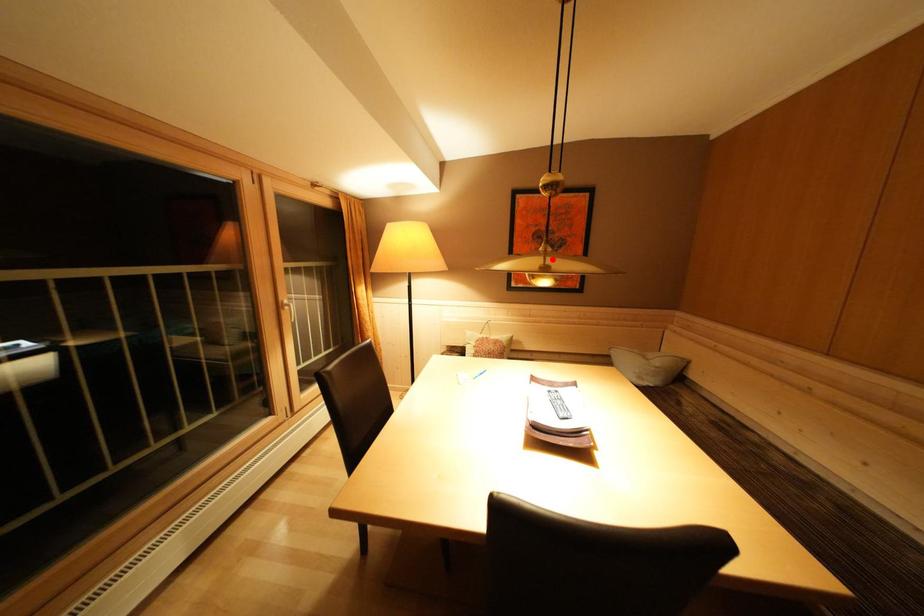
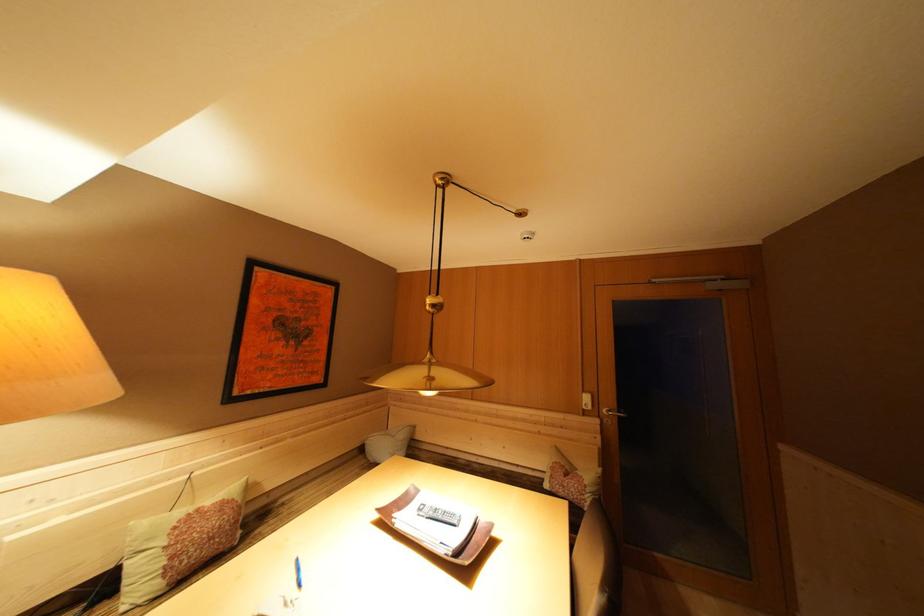
The point at the highlighted location is marked in the first image. Where is the corresponding point in the second image?

(438, 369)